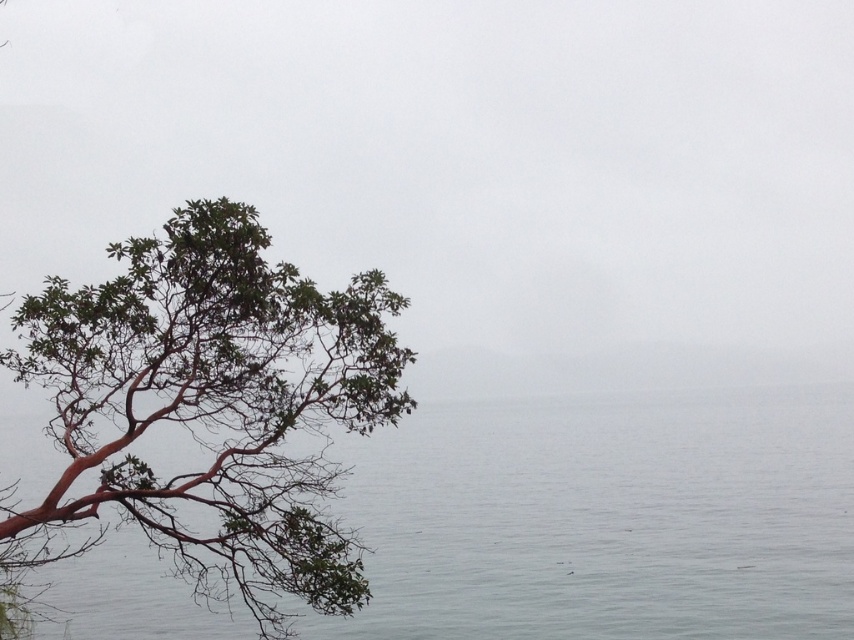
Between point (800, 545) and point (237, 376), which one is positioned in front?

Point (237, 376)

Between point (803, 442) and point (28, 556), which one is positioned behind?

Point (803, 442)

Which is behind, point (156, 611) or point (376, 301)?

Point (156, 611)

Locate an element on the screen. Image resolution: width=854 pixels, height=640 pixels. clear water at left is located at coordinates (607, 518).